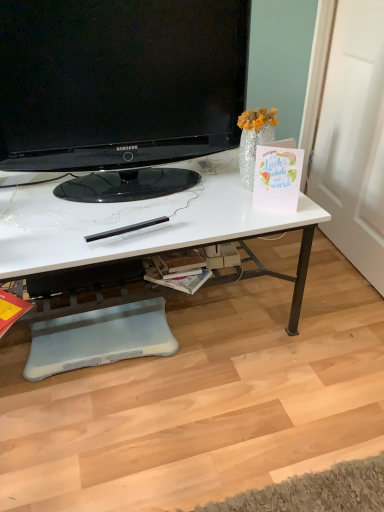
Question: Does matte yellow magazine at lower left, which is the 1th magazine from left to right, have a greater width compared to white glossy desk at center?

Choices:
 (A) yes
 (B) no

Answer: (B)

Question: From the image's perspective, would you say matte yellow magazine at lower left, placed as the 2th magazine when sorted from right to left, is shown under white glossy desk at center?

Choices:
 (A) yes
 (B) no

Answer: (A)

Question: Does matte yellow magazine at lower left, which is the 1th magazine from left to right, touch white glossy desk at center?

Choices:
 (A) no
 (B) yes

Answer: (A)

Question: From the image's perspective, is matte yellow magazine at lower left, placed as the 2th magazine when sorted from right to left, over white glossy desk at center?

Choices:
 (A) no
 (B) yes

Answer: (A)

Question: Does matte yellow magazine at lower left, placed as the 2th magazine when sorted from right to left, have a smaller size compared to white glossy desk at center?

Choices:
 (A) no
 (B) yes

Answer: (B)

Question: Do you think white paper magazine at center, the 2th magazine from the left, is within white glossy desk at center, or outside of it?

Choices:
 (A) outside
 (B) inside

Answer: (B)

Question: Based on their sizes in the image, would you say white paper magazine at center, acting as the 1th magazine starting from the right, is bigger or smaller than white glossy desk at center?

Choices:
 (A) small
 (B) big

Answer: (A)

Question: Based on their positions, is white paper magazine at center, acting as the 1th magazine starting from the right, located to the left or right of white glossy desk at center?

Choices:
 (A) left
 (B) right

Answer: (B)

Question: Considering the positions of white paper magazine at center, acting as the 1th magazine starting from the right, and white glossy desk at center in the image, is white paper magazine at center, acting as the 1th magazine starting from the right, wider or thinner than white glossy desk at center?

Choices:
 (A) thin
 (B) wide

Answer: (A)

Question: From a real-world perspective, is white glossy desk at center positioned above or below white paper magazine at center, the 2th magazine from the left?

Choices:
 (A) above
 (B) below

Answer: (A)

Question: Is white glossy desk at center in front of or behind white paper magazine at center, the 2th magazine from the left, in the image?

Choices:
 (A) front
 (B) behind

Answer: (A)

Question: Is white glossy desk at center taller or shorter than white paper magazine at center, acting as the 1th magazine starting from the right?

Choices:
 (A) short
 (B) tall

Answer: (B)

Question: Looking at their shapes, would you say white glossy desk at center is wider or thinner than white paper magazine at center, acting as the 1th magazine starting from the right?

Choices:
 (A) wide
 (B) thin

Answer: (A)

Question: Considering the positions of white glossy desk at center and matte yellow magazine at lower left, which is the 1th magazine from left to right, in the image, is white glossy desk at center wider or thinner than matte yellow magazine at lower left, which is the 1th magazine from left to right,?

Choices:
 (A) wide
 (B) thin

Answer: (A)

Question: Relative to matte yellow magazine at lower left, which is the 1th magazine from left to right, is white glossy desk at center in front or behind?

Choices:
 (A) front
 (B) behind

Answer: (A)